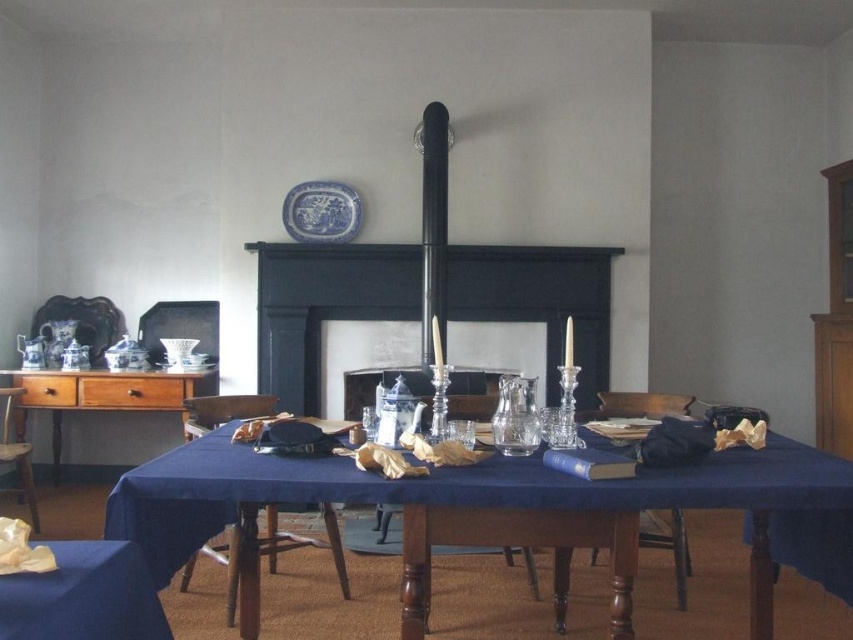
Between blue fabric tablecloth at lower left and blue porcelain plate at upper center, which one is positioned lower?

Positioned lower is blue fabric tablecloth at lower left.

From the picture: Can you confirm if blue fabric tablecloth at lower left is wider than blue porcelain plate at upper center?

In fact, blue fabric tablecloth at lower left might be narrower than blue porcelain plate at upper center.

At what (x,y) coordinates should I click in order to perform the action: click on blue fabric tablecloth at lower left. Please return your answer as a coordinate pair (x, y). This screenshot has width=853, height=640. Looking at the image, I should click on (83, 595).

Can you confirm if smooth wooden table at center is positioned to the right of wooden chair at center?

Yes, smooth wooden table at center is to the right of wooden chair at center.

Which is behind, point (648, 492) or point (260, 552)?

The point (260, 552) is behind.

Where is `smooth wooden table at center`? smooth wooden table at center is located at coordinates pyautogui.click(x=466, y=509).

Identify the location of smooth wooden table at center. (466, 509).

Based on the photo, measure the distance between smooth wooden table at center and camera.

smooth wooden table at center and camera are 1.81 meters apart.

Does point (283, 481) come farther from viewer compared to point (167, 625)?

Yes, point (283, 481) is farther from viewer.

Where is `smooth wooden table at center`? smooth wooden table at center is located at coordinates (466, 509).